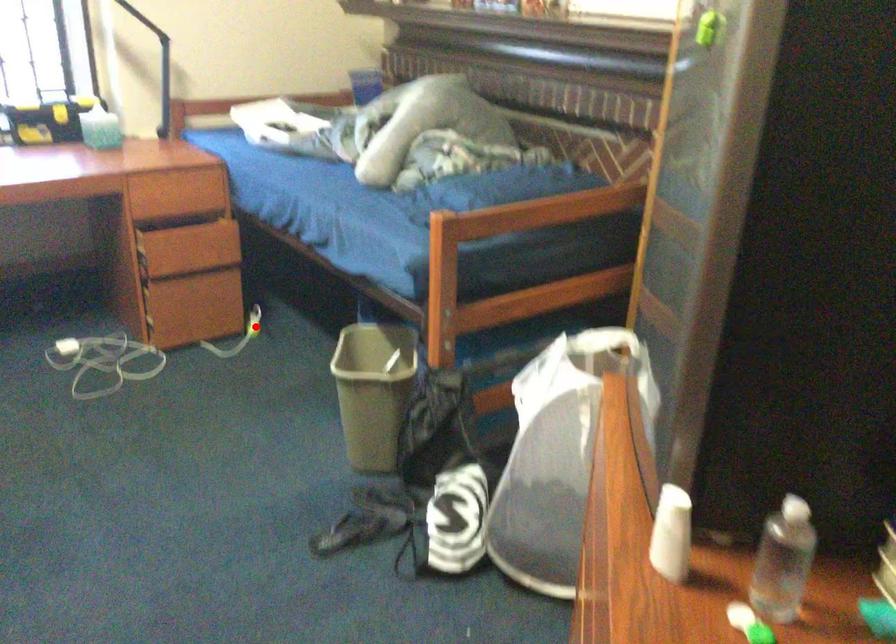
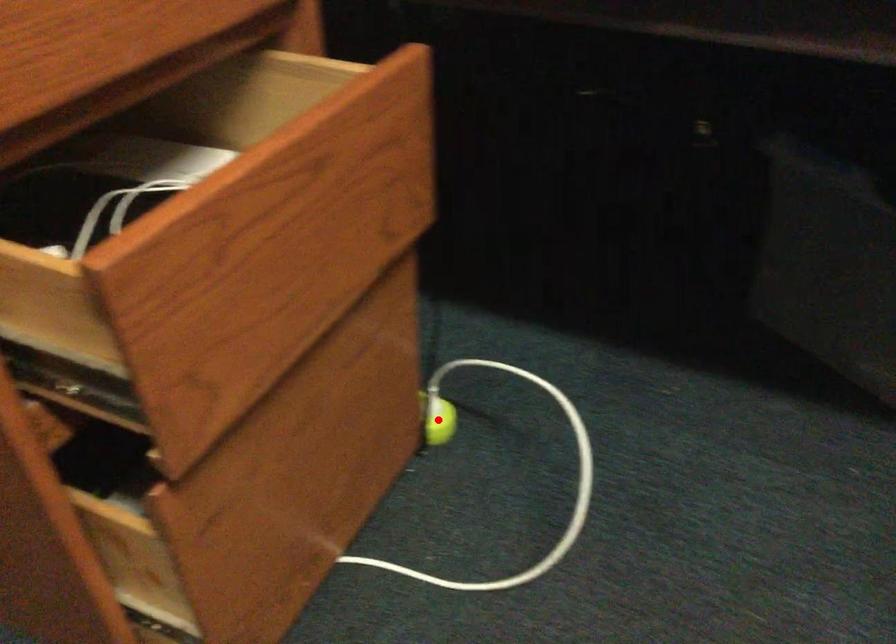
I am providing you with two images of the same scene from different viewpoints. A red point is marked on the first image and another point is marked on the second image. Does the point marked in image1 correspond to the same location as the one in image2?

Yes